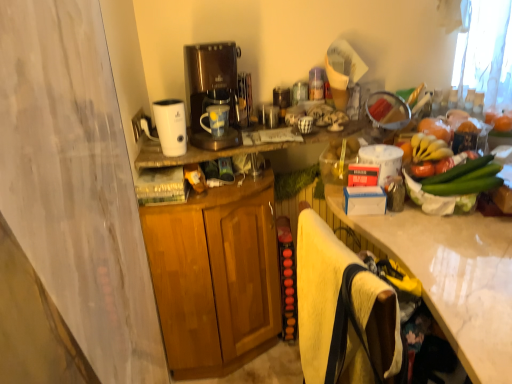
Identify the location of blank space situated above yellow fuzzy beach towel at lower right (from a real-world perspective). This screenshot has width=512, height=384. (333, 245).